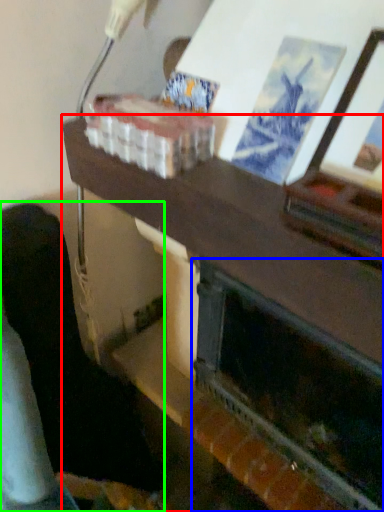
Question: Which object is positioned closest to table (highlighted by a red box)? Select from fireplace (highlighted by a blue box) and furniture (highlighted by a green box).

Choices:
 (A) fireplace
 (B) furniture

Answer: (A)